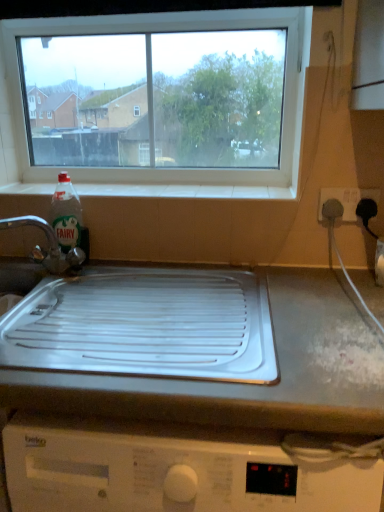
Question: Is white plastic socket at right located outside brushed metal tap at left?

Choices:
 (A) no
 (B) yes

Answer: (B)

Question: From the image's perspective, is white plastic socket at right located beneath brushed metal tap at left?

Choices:
 (A) yes
 (B) no

Answer: (B)

Question: From a real-world perspective, is white plastic socket at right over brushed metal tap at left?

Choices:
 (A) yes
 (B) no

Answer: (A)

Question: Considering the relative sizes of white plastic socket at right and brushed metal tap at left in the image provided, is white plastic socket at right wider than brushed metal tap at left?

Choices:
 (A) yes
 (B) no

Answer: (B)

Question: Are white plastic socket at right and brushed metal tap at left making contact?

Choices:
 (A) yes
 (B) no

Answer: (B)

Question: Is white plastic tray at center to the left or to the right of white plastic socket at right in the image?

Choices:
 (A) left
 (B) right

Answer: (A)

Question: Looking at their shapes, would you say white plastic tray at center is wider or thinner than white plastic socket at right?

Choices:
 (A) wide
 (B) thin

Answer: (A)

Question: Is point (56, 344) closer or farther from the camera than point (339, 188)?

Choices:
 (A) farther
 (B) closer

Answer: (B)

Question: Is white plastic tray at center spatially inside white plastic socket at right, or outside of it?

Choices:
 (A) inside
 (B) outside

Answer: (B)

Question: Relative to white plastic tray at center, is white tile at upper center in front or behind?

Choices:
 (A) behind
 (B) front

Answer: (A)

Question: Is white tile at upper center spatially inside white plastic tray at center, or outside of it?

Choices:
 (A) inside
 (B) outside

Answer: (B)

Question: Is white tile at upper center to the left or to the right of white plastic tray at center in the image?

Choices:
 (A) left
 (B) right

Answer: (A)

Question: Does point (231, 190) appear closer or farther from the camera than point (223, 373)?

Choices:
 (A) closer
 (B) farther

Answer: (B)

Question: Which is correct: white plastic socket at right is inside brushed metal tap at left, or outside of it?

Choices:
 (A) outside
 (B) inside

Answer: (A)

Question: Is white plastic socket at right to the left or to the right of brushed metal tap at left in the image?

Choices:
 (A) right
 (B) left

Answer: (A)